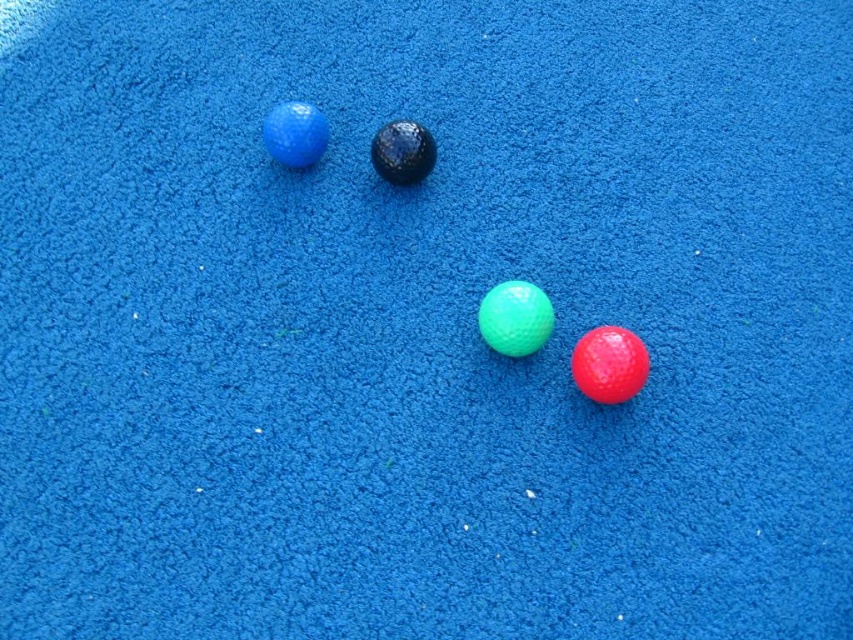
Question: Which object is positioned closest to the glossy rubber ball at lower right?

Choices:
 (A) matte blue golf ball at upper left
 (B) glossy green golf ball at center
 (C) glossy black golf ball at center

Answer: (B)

Question: Can you confirm if glossy rubber ball at lower right is bigger than matte blue golf ball at upper left?

Choices:
 (A) no
 (B) yes

Answer: (B)

Question: Which object is closer to the camera taking this photo?

Choices:
 (A) matte blue golf ball at upper left
 (B) glossy green golf ball at center
 (C) glossy black golf ball at center

Answer: (B)

Question: Based on their relative distances, which object is nearer to the glossy black golf ball at center?

Choices:
 (A) glossy rubber ball at lower right
 (B) matte blue golf ball at upper left
 (C) glossy green golf ball at center

Answer: (B)

Question: Is the position of glossy rubber ball at lower right more distant than that of glossy green golf ball at center?

Choices:
 (A) no
 (B) yes

Answer: (A)

Question: In this image, where is glossy rubber ball at lower right located relative to glossy black golf ball at center?

Choices:
 (A) left
 (B) right

Answer: (B)